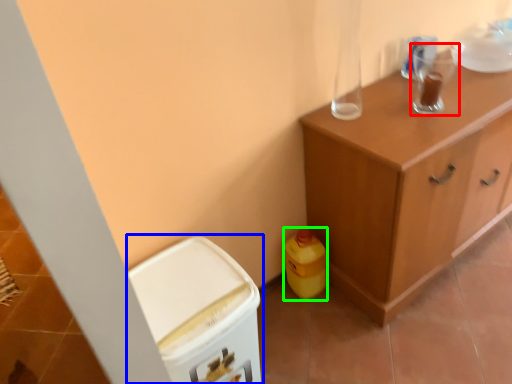
Question: Which object is positioned closest to appliance (highlighted by a red box)? Select from cabinetry (highlighted by a blue box) and cleaning product (highlighted by a green box).

Choices:
 (A) cabinetry
 (B) cleaning product

Answer: (B)